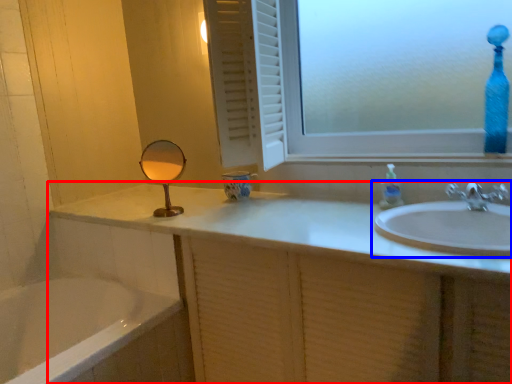
Question: Which object is closer to the camera taking this photo, bathroom cabinet (highlighted by a red box) or sink (highlighted by a blue box)?

Choices:
 (A) bathroom cabinet
 (B) sink

Answer: (A)